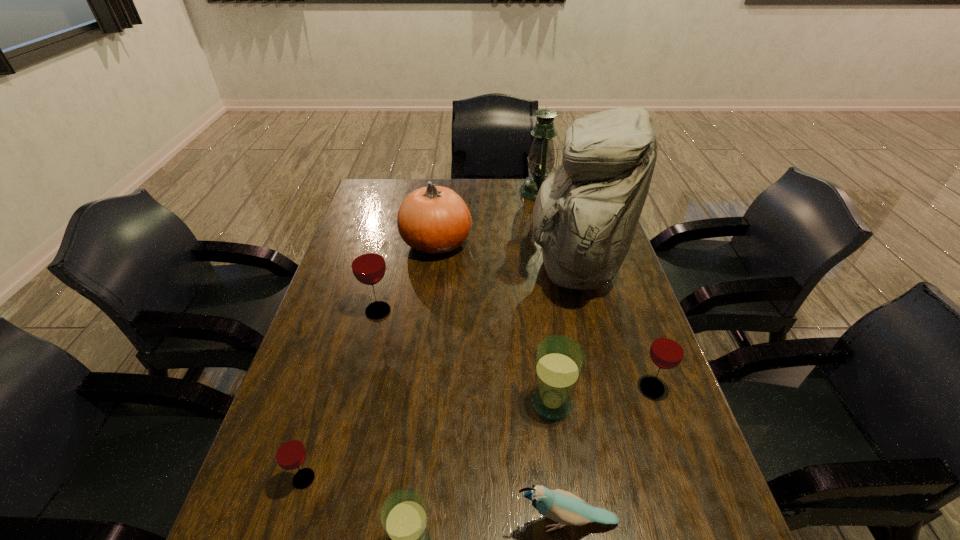
Where is `bird`? This screenshot has height=540, width=960. bird is located at coordinates (564, 507).

In order to click on the second nearest glass in this screenshot , I will do `click(289, 451)`.

The width and height of the screenshot is (960, 540). I want to click on the smallest red glass, so click(x=289, y=451).

Where is `vacant region located 0.310m on the front-facing side of the backpack`? This screenshot has width=960, height=540. vacant region located 0.310m on the front-facing side of the backpack is located at coordinates (428, 268).

You are a GUI agent. You are given a task and a screenshot of the screen. Output one action in this format:
    pyautogui.click(x=<x>, y=<y>)
    Task: Click on the vacant space located on the front-facing side of the backpack
    The width and height of the screenshot is (960, 540).
    Given the screenshot: What is the action you would take?
    pyautogui.click(x=444, y=268)

This screenshot has width=960, height=540. In order to click on vacant space located on the front-facing side of the backpack in this screenshot , I will do `click(508, 268)`.

Identify the location of vacant space located on the front of the oil lamp. This screenshot has height=540, width=960. (542, 214).

The height and width of the screenshot is (540, 960). I want to click on free location located 0.260m on the back of the pumpkin, so click(444, 187).

Find the location of `vacant area situated 0.360m on the right of the biggest red glass`. vacant area situated 0.360m on the right of the biggest red glass is located at coordinates (521, 311).

Identify the location of free space located 0.120m on the back of the second nearest red glass. pyautogui.click(x=635, y=338).